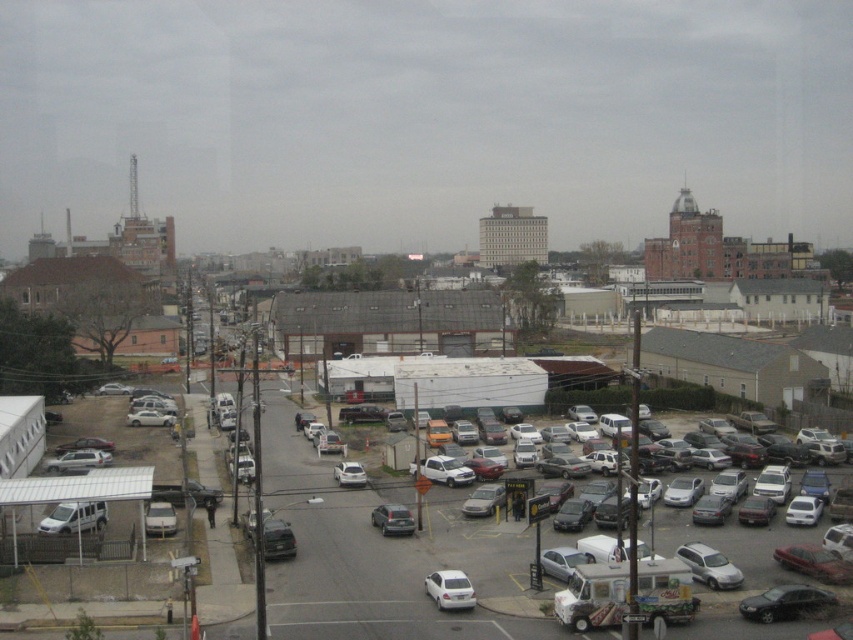
Is white painted truck at lower right smaller than white matte van at lower left?

Yes, white painted truck at lower right is smaller than white matte van at lower left.

Image resolution: width=853 pixels, height=640 pixels. I want to click on white painted truck at lower right, so click(x=593, y=596).

Is point (608, 563) positioned before point (76, 518)?

Yes.

The width and height of the screenshot is (853, 640). In order to click on white painted truck at lower right in this screenshot , I will do `click(593, 596)`.

How much distance is there between matte black sedan at lower right and white matte car at center?

matte black sedan at lower right is 39.95 feet away from white matte car at center.

Can you confirm if matte black sedan at lower right is thinner than white matte car at center?

Incorrect, matte black sedan at lower right's width is not less than white matte car at center's.

Is point (759, 600) positioned behind point (430, 595)?

That is False.

Where is `matte black sedan at lower right`? matte black sedan at lower right is located at coordinates (785, 602).

Is point (677, 566) positioned behind point (799, 588)?

No.

Does white painted truck at lower right have a larger size compared to matte black sedan at lower right?

Actually, white painted truck at lower right might be smaller than matte black sedan at lower right.

Locate an element on the screen. The image size is (853, 640). white painted truck at lower right is located at coordinates (593, 596).